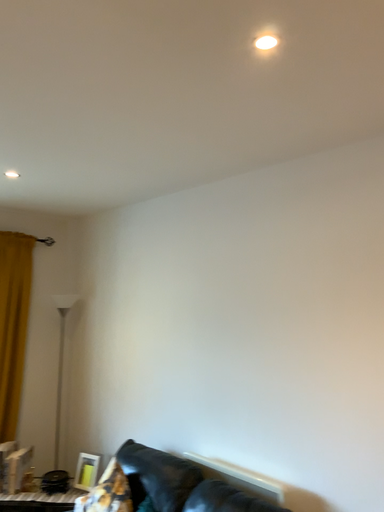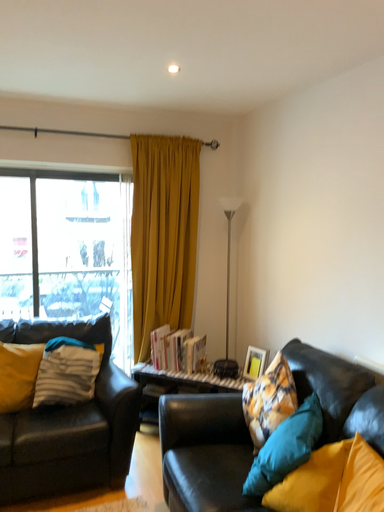
Question: How did the camera likely rotate when shooting the video?

Choices:
 (A) rotated upward
 (B) rotated downward

Answer: (B)